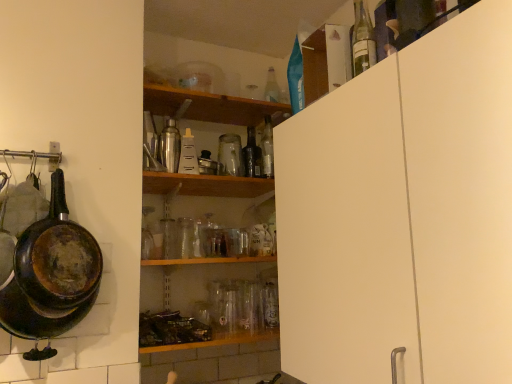
Measure the distance between point (360, 381) and camera.

They are 38.54 inches apart.

What are the coordinates of `black glass bottle at center, the 4th bottle when ordered from left to right` in the screenshot? It's located at click(x=252, y=155).

Identify the location of rusty cast iron frying pan at left. (51, 274).

What do you see at coordinates (51, 274) in the screenshot?
I see `rusty cast iron frying pan at left` at bounding box center [51, 274].

Identify the location of clear plastic bottle at upper right. 326,61.

How much space does clear plastic bottle at center, which is the 3th bottle in back-to-front order, occupy horizontally?

5.59 inches.

You are a GUI agent. You are given a task and a screenshot of the screen. Output one action in this format:
    pyautogui.click(x=<x>, y=<y>)
    Task: Click on the brushed metal shaker at upper center, which appears as the 2th bottle when viewed from the left
    The height and width of the screenshot is (384, 512).
    Given the screenshot: What is the action you would take?
    pyautogui.click(x=170, y=146)

Does clear glass bottle at upper right, the 6th bottle from the left, have a lesser height compared to clear plastic bottle at upper right?

No.

Consider the image. Considering the sizes of clear glass bottle at upper right, which appears as the 1th bottle when viewed from the right, and clear plastic bottle at upper right in the image, is clear glass bottle at upper right, which appears as the 1th bottle when viewed from the right, bigger or smaller than clear plastic bottle at upper right?

Considering their sizes, clear glass bottle at upper right, which appears as the 1th bottle when viewed from the right, takes up less space than clear plastic bottle at upper right.

Which point is more forward, (356, 15) or (323, 59)?

The point (356, 15) is closer.

From a real-world perspective, is metallic silver shaker at center, the sixth bottle positioned from the right, positioned above or below clear plastic bottle at center, which is the 3th bottle in back-to-front order?

Clearly, from a real-world perspective, metallic silver shaker at center, the sixth bottle positioned from the right, is above clear plastic bottle at center, which is the 3th bottle in back-to-front order.

In the scene shown: Is metallic silver shaker at center, the fifth bottle viewed from the back, to the left or to the right of clear plastic bottle at center, which appears as the 4th bottle when viewed from the right, in the image?

In the image, metallic silver shaker at center, the fifth bottle viewed from the back, appears on the left side of clear plastic bottle at center, which appears as the 4th bottle when viewed from the right.

Is metallic silver shaker at center, positioned as the second bottle in front-to-back order, surrounding clear plastic bottle at center, which is the 3th bottle in back-to-front order?

No, clear plastic bottle at center, which is the 3th bottle in back-to-front order, is not surrounded by metallic silver shaker at center, positioned as the second bottle in front-to-back order.

Between white matte cabinet at upper right and clear plastic bottle at upper right, which one has larger size?

With larger size is white matte cabinet at upper right.

From the image's perspective, who appears lower, white matte cabinet at upper right or clear plastic bottle at upper right?

white matte cabinet at upper right.

Which object is thinner, white matte cabinet at upper right or clear plastic bottle at upper right?

clear plastic bottle at upper right is thinner.

Between white matte cabinet at upper right and clear plastic bottle at upper right, which one appears on the left side from the viewer's perspective?

clear plastic bottle at upper right.

Which of these two, clear glass bottle at upper right, the 6th bottle from the left, or white matte cabinet at upper right, is smaller?

With smaller size is clear glass bottle at upper right, the 6th bottle from the left.

From a real-world perspective, which object rests below the other?

In real-world perspective, white matte cabinet at upper right is lower.

Which is nearer, (x=375, y=43) or (x=432, y=127)?

Point (x=375, y=43) is farther from the camera than point (x=432, y=127).

Can you tell me how much clear plastic bottle at center, which appears as the 4th bottle when viewed from the right, and clear glass bottle at upper center, which is counted as the first bottle, starting from the back, differ in facing direction?

The angle between the facing direction of clear plastic bottle at center, which appears as the 4th bottle when viewed from the right, and the facing direction of clear glass bottle at upper center, which is counted as the first bottle, starting from the back, is 3.1 degrees.

Would you say clear plastic bottle at center, which appears as the 4th bottle when viewed from the right, is inside or outside clear glass bottle at upper center, which ranks as the 2th bottle in right-to-left order?

clear plastic bottle at center, which appears as the 4th bottle when viewed from the right, is located beyond the bounds of clear glass bottle at upper center, which ranks as the 2th bottle in right-to-left order.

From the image's perspective, which one is positioned lower, clear plastic bottle at center, which is counted as the 4th bottle, starting from the front, or clear glass bottle at upper center, marked as the 5th bottle in a left-to-right arrangement?

clear plastic bottle at center, which is counted as the 4th bottle, starting from the front, is shown below in the image.

Considering the relative sizes of clear plastic bottle at center, the third bottle positioned from the left, and clear glass bottle at upper center, the 6th bottle when ordered from front to back, in the image provided, is clear plastic bottle at center, the third bottle positioned from the left, bigger than clear glass bottle at upper center, the 6th bottle when ordered from front to back,?

Actually, clear plastic bottle at center, the third bottle positioned from the left, might be smaller than clear glass bottle at upper center, the 6th bottle when ordered from front to back.

Is point (180, 159) in front of point (152, 167)?

No, it is behind (152, 167).

Can you confirm if clear plastic bottle at center, which appears as the 4th bottle when viewed from the right, is smaller than metallic silver shaker at center, the sixth bottle positioned from the right?

Correct, clear plastic bottle at center, which appears as the 4th bottle when viewed from the right, occupies less space than metallic silver shaker at center, the sixth bottle positioned from the right.

Consider the image. Are clear plastic bottle at center, the third bottle positioned from the left, and metallic silver shaker at center, the fifth bottle viewed from the back, located far from each other?

clear plastic bottle at center, the third bottle positioned from the left, is near metallic silver shaker at center, the fifth bottle viewed from the back, not far away.

Which of these two, clear glass bottle at upper right, which is counted as the 6th bottle, starting from the back, or clear plastic bottle at center, the third bottle positioned from the left, is wider?

With larger width is clear plastic bottle at center, the third bottle positioned from the left.

From a real-world perspective, which bottle is the 4th one above the clear plastic bottle at center, the third bottle positioned from the left? Please provide its 2D coordinates.

[(362, 41)]

Is clear plastic bottle at center, which is counted as the 4th bottle, starting from the front, at the back of clear glass bottle at upper right, which is counted as the 6th bottle, starting from the back?

No.

This screenshot has height=384, width=512. In order to click on bottle in front of the clear plastic bottle at upper right in this screenshot , I will do `click(362, 41)`.

Locate an element on the screen. bottle that is the 2nd one when counting backward from the metallic silver shaker at center, the fifth bottle viewed from the back is located at coordinates (188, 155).

Which object lies further to the anchor point clear plastic bottle at center, which is the 3th bottle in back-to-front order, clear glass bottle at upper center, which ranks as the 2th bottle in right-to-left order, or metallic silver shaker at center, the sixth bottle positioned from the right?

clear glass bottle at upper center, which ranks as the 2th bottle in right-to-left order, is positioned further to the anchor clear plastic bottle at center, which is the 3th bottle in back-to-front order.

Which object lies nearer to the anchor point clear glass bottle at upper center, which ranks as the 2th bottle in right-to-left order, white matte cabinet at upper right or metallic silver shaker at center, positioned as the second bottle in front-to-back order?

metallic silver shaker at center, positioned as the second bottle in front-to-back order.

Looking at the image, which one is located further to clear glass bottle at upper right, which is counted as the 6th bottle, starting from the back, clear glass bottle at upper center, which ranks as the 2th bottle in right-to-left order, or black glass bottle at center, the second bottle viewed from the back?

Among the two, clear glass bottle at upper center, which ranks as the 2th bottle in right-to-left order, is located further to clear glass bottle at upper right, which is counted as the 6th bottle, starting from the back.

Estimate the real-world distances between objects in this image. Which object is closer to clear glass bottle at upper center, which ranks as the 2th bottle in right-to-left order, clear plastic bottle at center, which is the 3th bottle in back-to-front order, or metallic silver shaker at center, the sixth bottle positioned from the right?

Based on the image, clear plastic bottle at center, which is the 3th bottle in back-to-front order, appears to be nearer to clear glass bottle at upper center, which ranks as the 2th bottle in right-to-left order.

Estimate the real-world distances between objects in this image. Which object is further from brushed metal shaker at upper center, which appears as the fourth bottle when viewed from the back, clear plastic bottle at upper right or rusty cast iron frying pan at left?

The object further to brushed metal shaker at upper center, which appears as the fourth bottle when viewed from the back, is clear plastic bottle at upper right.

When comparing their distances from clear plastic bottle at upper right, does black glass bottle at center, the 4th bottle when ordered from left to right, or clear plastic bottle at center, which is the 3th bottle in back-to-front order, seem further?

clear plastic bottle at center, which is the 3th bottle in back-to-front order, is further to clear plastic bottle at upper right.

When comparing their distances from rusty cast iron frying pan at left, does white matte cabinet at upper right or clear plastic bottle at center, the third bottle positioned from the left, seem further?

white matte cabinet at upper right is further to rusty cast iron frying pan at left.

Considering their positions, is clear plastic bottle at upper right positioned closer to brushed metal shaker at upper center, the fifth bottle in the right-to-left sequence, than clear plastic bottle at center, which is the 3th bottle in back-to-front order?

The object closer to brushed metal shaker at upper center, the fifth bottle in the right-to-left sequence, is clear plastic bottle at center, which is the 3th bottle in back-to-front order.

At what (x,y) coordinates should I click in order to perform the action: click on bottle between clear plastic bottle at center, which is counted as the 4th bottle, starting from the front, and clear glass bottle at upper center, which ranks as the 2th bottle in right-to-left order, along the z-axis. Please return your answer as a coordinate pair (x, y). This screenshot has width=512, height=384. Looking at the image, I should click on (252, 155).

The image size is (512, 384). I want to click on bottle located between brushed metal shaker at upper center, which appears as the fourth bottle when viewed from the back, and black glass bottle at center, acting as the fifth bottle starting from the front, in the left-right direction, so click(x=188, y=155).

Locate an element on the screen. frying pan between clear glass bottle at upper right, which appears as the 1th bottle when viewed from the right, and clear glass bottle at upper center, which is counted as the first bottle, starting from the back, in the front-back direction is located at coordinates point(51,274).

Where is `cabinetry between white matte cabinet at upper right and clear plastic bottle at center, the third bottle positioned from the left, along the z-axis`? cabinetry between white matte cabinet at upper right and clear plastic bottle at center, the third bottle positioned from the left, along the z-axis is located at coordinates (326, 61).